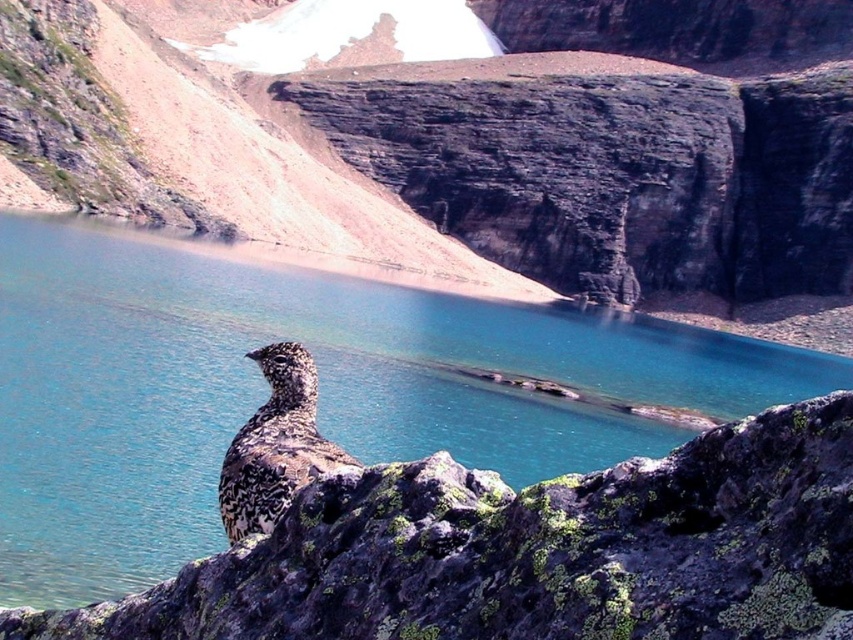
Question: Considering the real-world distances, which object is farthest from the speckled feathered bird at center?

Choices:
 (A) blue water at center
 (B) brown rocky hillside at upper center

Answer: (B)

Question: Which is farther from the blue water at center?

Choices:
 (A) brown rocky hillside at upper center
 (B) speckled feathered bird at center

Answer: (B)

Question: Is blue water at center further to camera compared to speckled feathered bird at center?

Choices:
 (A) no
 (B) yes

Answer: (B)

Question: Considering the relative positions of brown rocky hillside at upper center and speckled feathered bird at center in the image provided, where is brown rocky hillside at upper center located with respect to speckled feathered bird at center?

Choices:
 (A) below
 (B) above

Answer: (B)

Question: Is brown rocky hillside at upper center thinner than blue water at center?

Choices:
 (A) yes
 (B) no

Answer: (B)

Question: Among these points, which one is farthest from the camera?

Choices:
 (A) (647, 355)
 (B) (306, 465)

Answer: (A)